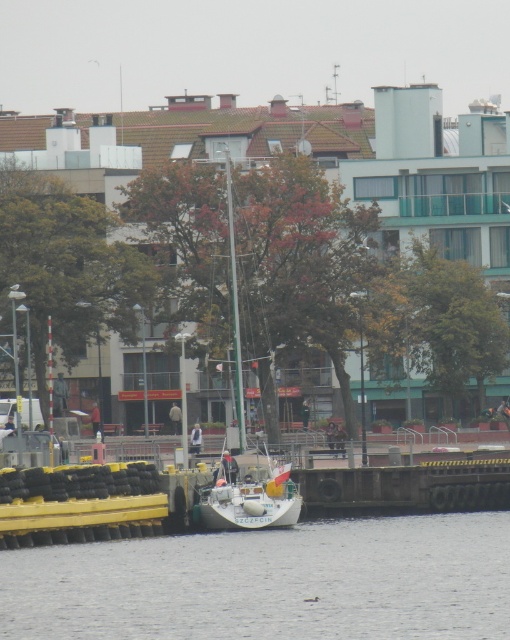
From the picture: You are a photographer planning to take a photo of the waterfront scene. You want to ensure that both the clear water at lower center and the white matte sailboat at center are visible in the frame. Based on their relative heights, which object will appear larger in your photo?

The white matte sailboat at center will appear larger in the photo because it is taller than the clear water at lower center.

You are standing at the camera position and want to throw a small floating toy into the clear water at lower center. If the toy can float up to 60 meters away, will it reach the water?

The clear water at lower center is 70.74 meters away from the camera, so the toy cannot reach it since it can only float up to 60 meters.

You are standing on the pier and see the clear water at lower center and the white matte sailboat at center. Which object is positioned to the right side of the other?

The clear water at lower center is to the right of the white matte sailboat at center.